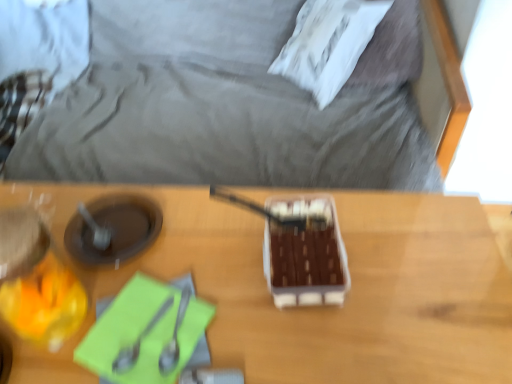
Locate an element on the screen. Image resolution: width=512 pixels, height=384 pixels. free space above green matte notepad at lower left (from a real-world perspective) is located at coordinates (146, 324).